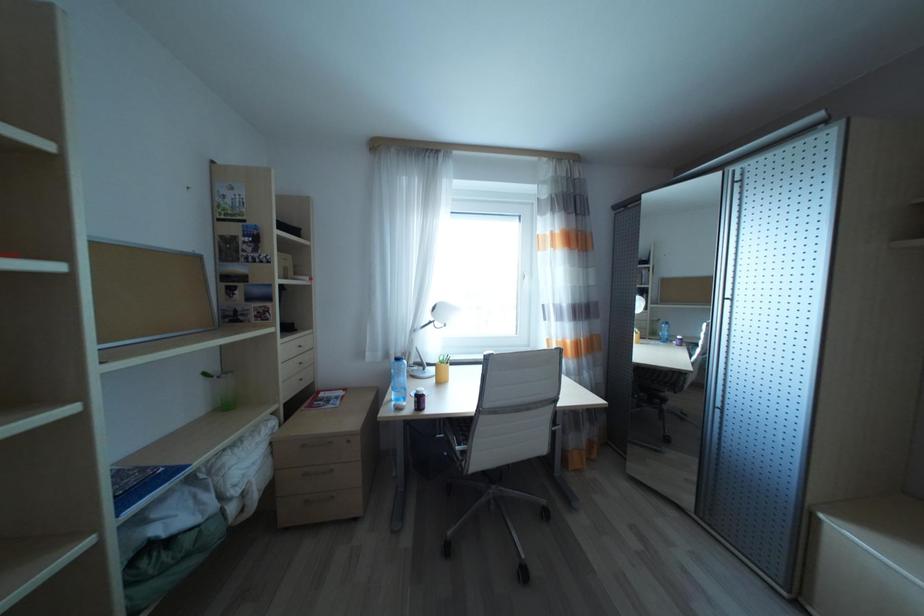
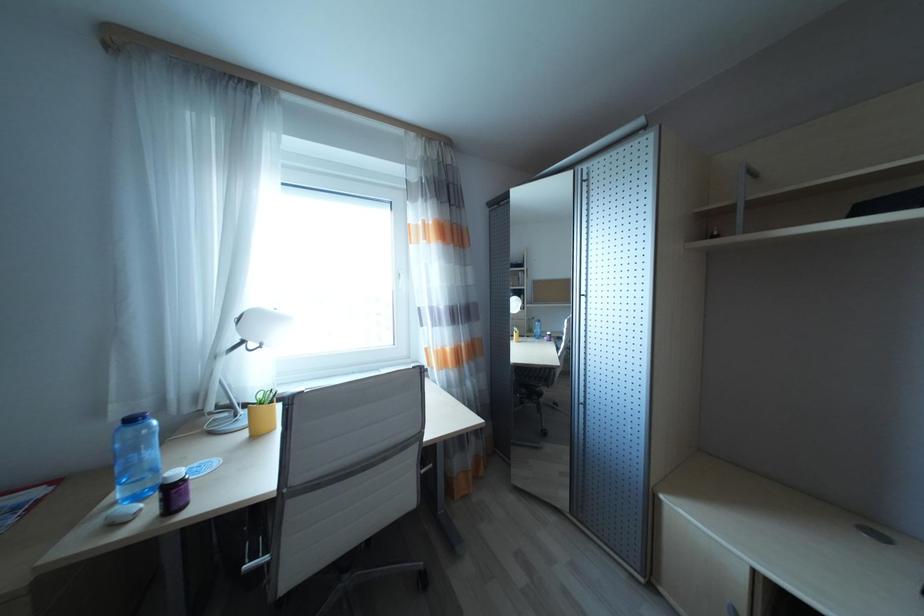
In a continuous first-person perspective shot, in which direction is the camera moving?

The movement direction of the cameraman is right, forward.